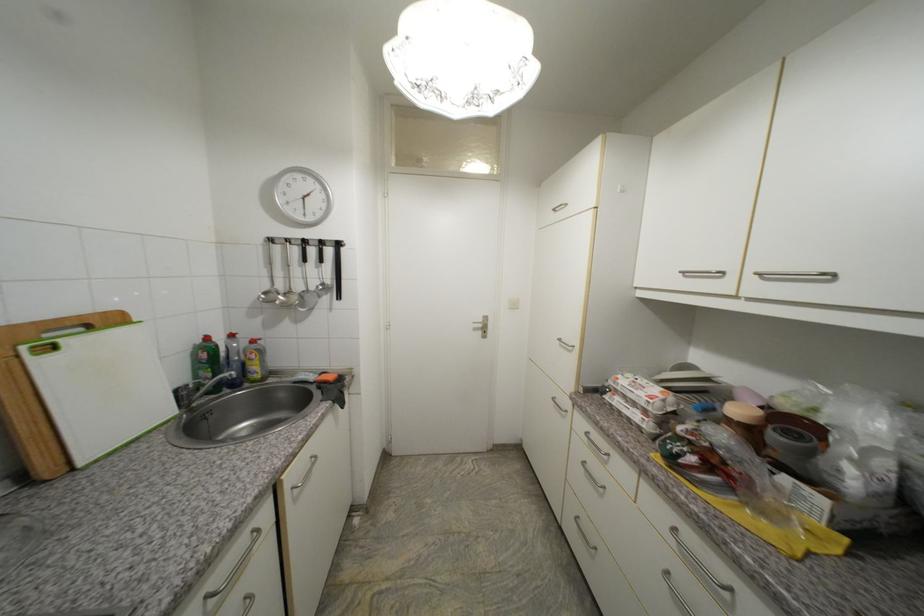
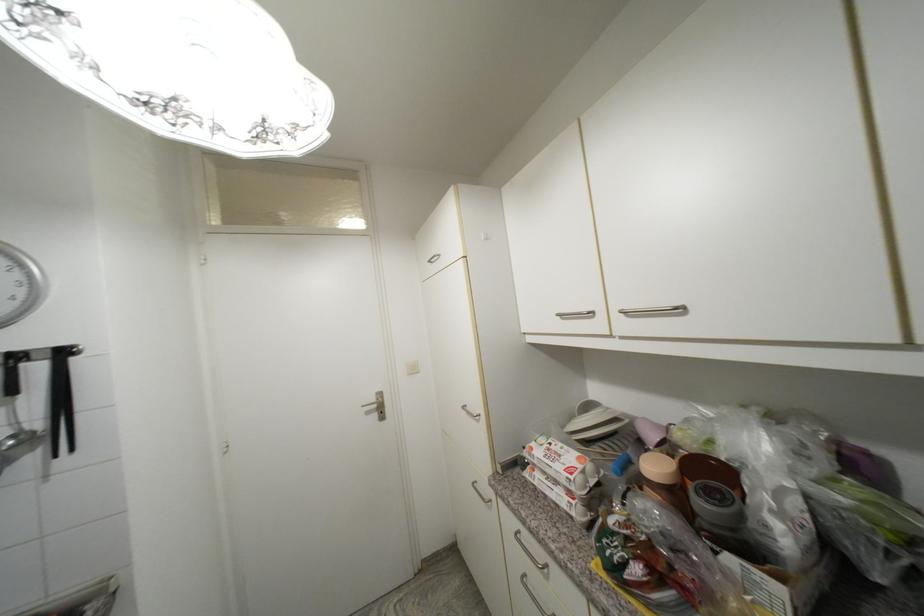
In the second image, find the point that corresponds to [771,272] in the first image.

(631, 309)